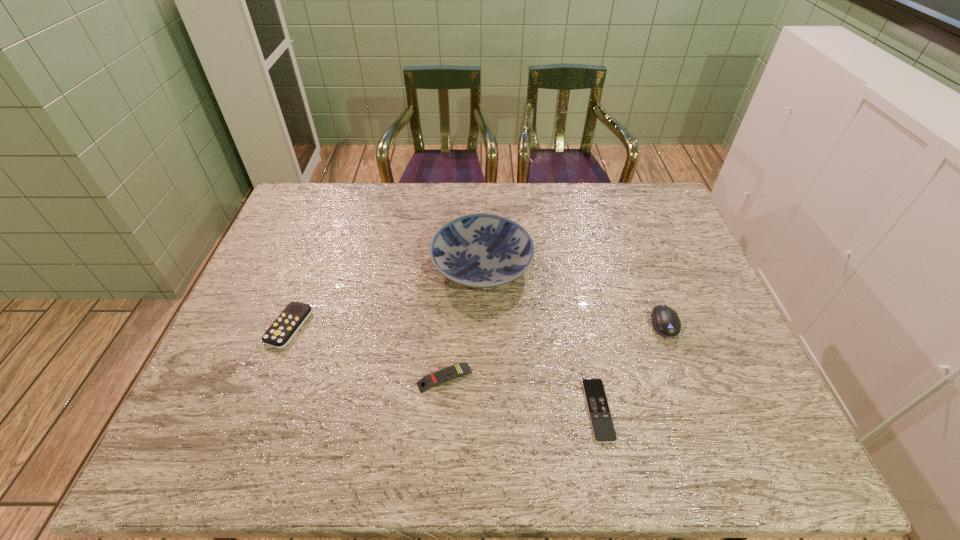
This screenshot has width=960, height=540. Identify the location of vacant space at the left edge. (295, 283).

Identify the location of free spot at the right edge of the desktop. This screenshot has width=960, height=540. (705, 292).

Where is `vacant region at the near left corner of the desktop`? The image size is (960, 540). vacant region at the near left corner of the desktop is located at coordinates (196, 451).

At what (x,y) coordinates should I click in order to perform the action: click on empty space that is in between the computer mouse and the shortest object. Please return your answer as a coordinate pair (x, y). Image resolution: width=960 pixels, height=540 pixels. Looking at the image, I should click on (632, 367).

At what (x,y) coordinates should I click in order to perform the action: click on vacant area that lies between the leftmost remote control and the rightmost object. Please return your answer as a coordinate pair (x, y). This screenshot has height=540, width=960. Looking at the image, I should click on (477, 325).

Where is `free space that is in between the second shortest remote control and the tallest object`? free space that is in between the second shortest remote control and the tallest object is located at coordinates (464, 322).

Locate an element on the screen. This screenshot has width=960, height=540. free area in between the rightmost object and the second shortest remote control is located at coordinates (555, 350).

Identify the location of unoccupied area between the rightmost object and the tallest object. (573, 294).

At what (x,y) coordinates should I click in order to perform the action: click on vacant area that lies between the rightmost object and the farthest object. Please return your answer as a coordinate pair (x, y). The height and width of the screenshot is (540, 960). Looking at the image, I should click on (x=573, y=294).

Find the location of a particular element. free point between the leftmost object and the shortest remote control is located at coordinates (444, 368).